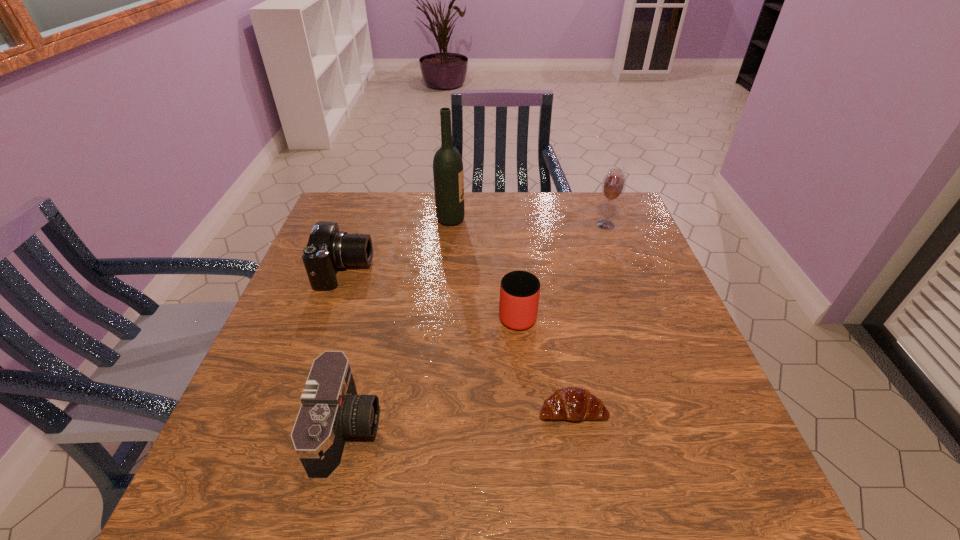
This screenshot has width=960, height=540. Find the location of `free region that satisfies the following two spatial constraints: 1. on the handle side of the fourth farthest object; 2. on the right side of the fifth shortest object`. free region that satisfies the following two spatial constraints: 1. on the handle side of the fourth farthest object; 2. on the right side of the fifth shortest object is located at coordinates (510, 225).

You are a GUI agent. You are given a task and a screenshot of the screen. Output one action in this format:
    pyautogui.click(x=<x>, y=<y>)
    Task: Click on the free region that satisfies the following two spatial constraints: 1. on the lens of the third farthest object; 2. on the right side of the crescent roll
    
    Given the screenshot: What is the action you would take?
    pyautogui.click(x=295, y=409)

This screenshot has height=540, width=960. I want to click on vacant region that satisfies the following two spatial constraints: 1. on the back side of the second tallest object; 2. on the left side of the shortest object, so click(540, 225).

Locate an element on the screen. This screenshot has height=540, width=960. vacant space that satisfies the following two spatial constraints: 1. on the labeled side of the third object from left to right; 2. on the back side of the shortest object is located at coordinates (434, 409).

Locate an element on the screen. free spot that satisfies the following two spatial constraints: 1. on the back side of the shortest object; 2. on the labeled side of the fourth object from right to left is located at coordinates (539, 220).

The image size is (960, 540). Identify the location of vacant area in the image that satisfies the following two spatial constraints: 1. on the lens of the fourth nearest object; 2. on the handle side of the third nearest object. (329, 313).

Image resolution: width=960 pixels, height=540 pixels. In order to click on vacant position in the image that satisfies the following two spatial constraints: 1. on the handle side of the fourth farthest object; 2. on the labeled side of the wine bottle in this screenshot , I will do `click(509, 220)`.

At what (x,y) coordinates should I click in order to perform the action: click on free point that satisfies the following two spatial constraints: 1. on the labeled side of the wine bottle; 2. on the back side of the crescent roll. Please return your answer as a coordinate pair (x, y). Looking at the image, I should click on (434, 409).

Where is `free space that satisfies the following two spatial constraints: 1. on the labeled side of the wine bottle; 2. on the handle side of the third nearest object`? This screenshot has width=960, height=540. free space that satisfies the following two spatial constraints: 1. on the labeled side of the wine bottle; 2. on the handle side of the third nearest object is located at coordinates (443, 313).

Where is `vacant space that satisfies the following two spatial constraints: 1. on the lens of the farther camera; 2. on the right side of the crescent roll`? vacant space that satisfies the following two spatial constraints: 1. on the lens of the farther camera; 2. on the right side of the crescent roll is located at coordinates (295, 409).